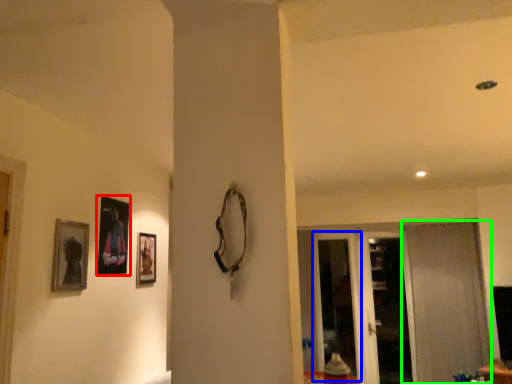
Question: Which object is the closest to the picture frame (highlighted by a red box)? Choose among these: screen door (highlighted by a blue box) or curtain (highlighted by a green box).

Choices:
 (A) screen door
 (B) curtain

Answer: (A)